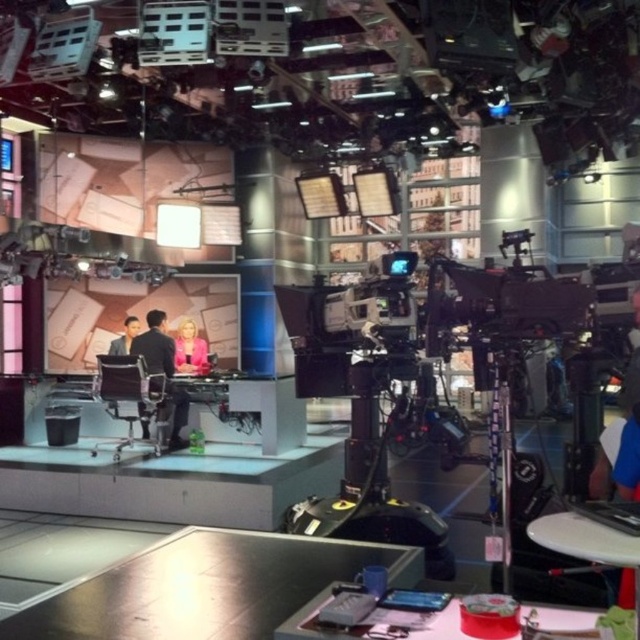
Question: Which object appears closest to the camera in this image?

Choices:
 (A) pink fabric at center
 (B) matte black suit at left

Answer: (A)

Question: Among these points, which one is nearest to the camera?

Choices:
 (A) (163, 316)
 (B) (202, 353)
 (C) (120, 340)

Answer: (A)

Question: Can you confirm if dark suit at center is smaller than pink fabric at center?

Choices:
 (A) no
 (B) yes

Answer: (A)

Question: Does dark suit at center appear under pink fabric at center?

Choices:
 (A) no
 (B) yes

Answer: (B)

Question: Which of the following is the farthest from the observer?

Choices:
 (A) dark suit at center
 (B) pink fabric at center

Answer: (B)

Question: Can you confirm if dark suit at center is smaller than pink fabric at center?

Choices:
 (A) yes
 (B) no

Answer: (B)